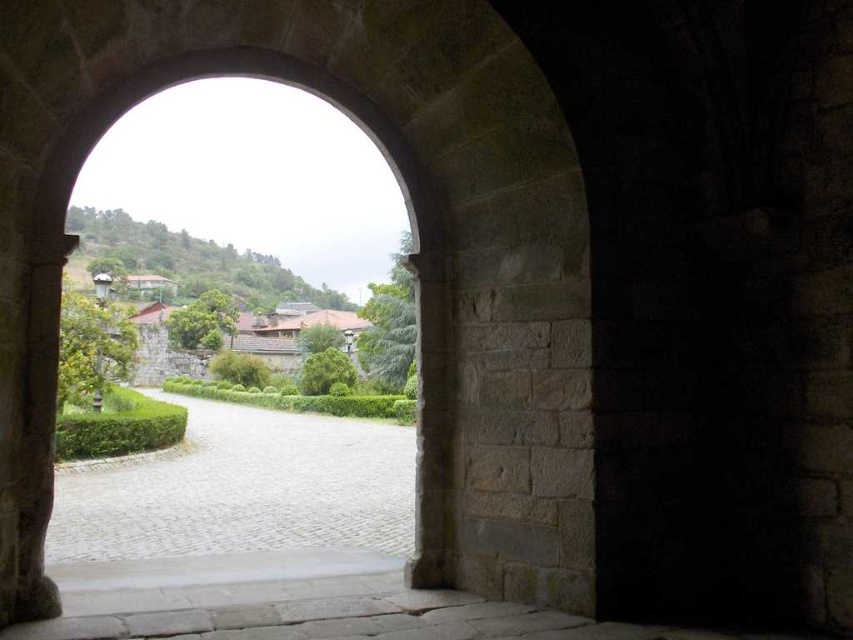
Is paved stone path at center above stone archway at center?

No, paved stone path at center is not above stone archway at center.

Does paved stone path at center appear on the right side of stone archway at center?

Incorrect, paved stone path at center is not on the right side of stone archway at center.

What do you see at coordinates (242, 488) in the screenshot? I see `paved stone path at center` at bounding box center [242, 488].

The height and width of the screenshot is (640, 853). Find the location of `paved stone path at center`. paved stone path at center is located at coordinates click(242, 488).